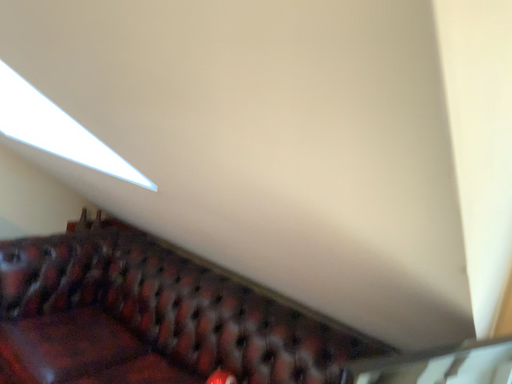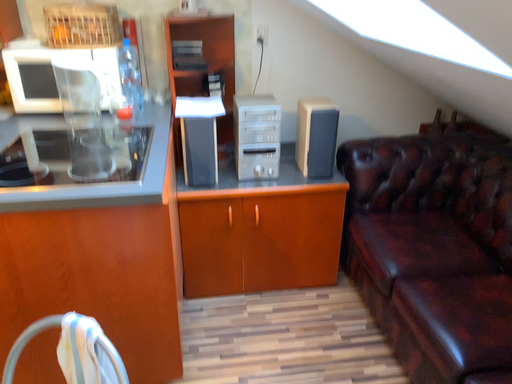
Question: How did the camera likely rotate when shooting the video?

Choices:
 (A) rotated left
 (B) rotated right

Answer: (A)